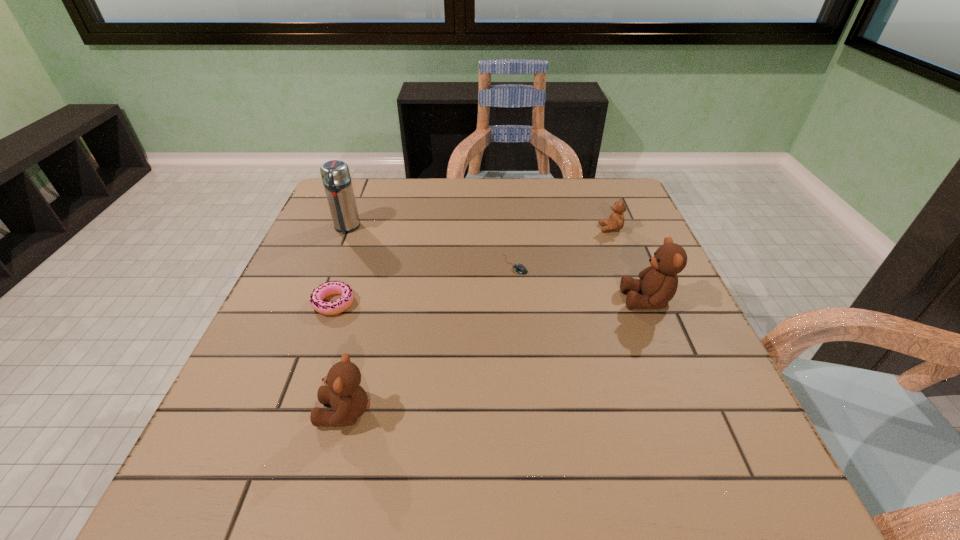
Image resolution: width=960 pixels, height=540 pixels. What are the coordinates of `vacant space located on the face of the nearest object` in the screenshot? It's located at (233, 412).

Identify the location of free space located on the face of the nearest object. Image resolution: width=960 pixels, height=540 pixels. (274, 412).

The width and height of the screenshot is (960, 540). Identify the location of vacant space situated 0.050m on the face of the nearest object. (290, 412).

Locate an element on the screen. Image resolution: width=960 pixels, height=540 pixels. free space located 0.340m on the face of the tallest teddy bear is located at coordinates (470, 300).

Identify the location of vacant point located 0.140m on the face of the tallest teddy bear. pos(560,300).

The height and width of the screenshot is (540, 960). Find the location of `vacant space located 0.400m on the face of the tallest teddy bear`. vacant space located 0.400m on the face of the tallest teddy bear is located at coordinates (444, 300).

This screenshot has height=540, width=960. I want to click on vacant space located on the back of the shortest object, so click(509, 197).

The height and width of the screenshot is (540, 960). In order to click on blank area located on the face of the fourth tallest object in this screenshot , I will do `click(544, 228)`.

Image resolution: width=960 pixels, height=540 pixels. Find the location of `free space located 0.310m on the face of the fourth tallest object`. free space located 0.310m on the face of the fourth tallest object is located at coordinates (485, 228).

Image resolution: width=960 pixels, height=540 pixels. What are the coordinates of `free space located on the face of the fourth tallest object` in the screenshot? It's located at (467, 228).